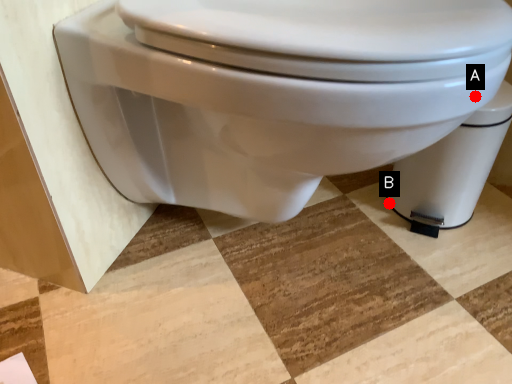
Question: Two points are circled on the image, labeled by A and B beside each circle. Which point appears closest to the camera in this image?

Choices:
 (A) A is closer
 (B) B is closer

Answer: (A)